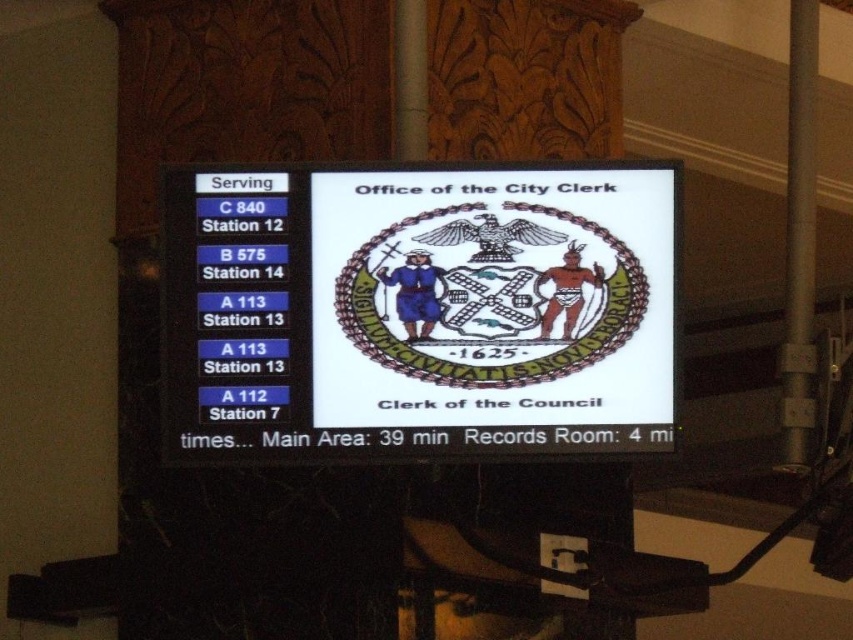
You are a visitor at the city hall and see the white glossy scoreboard at center and the metallic gray pole at right. Which object takes up more space in the image?

The metallic gray pole at right takes up more space in the image because the white glossy scoreboard at center occupies less space than metallic gray pole at right.

Based on the photo, you are standing in front of the digital display screen and notice two points marked on the screen. The first point is at coordinates point (474, 408) and the second is at point (804, 266). Which point appears closer to you?

Point (474, 408) is closer to the viewer than point (804, 266).

You are a visitor in a public building and see a digital display screen. According to the scene description, there is a point at coordinates (416, 310). What object is located at that point?

The white glossy scoreboard at center is located at point (416, 310).